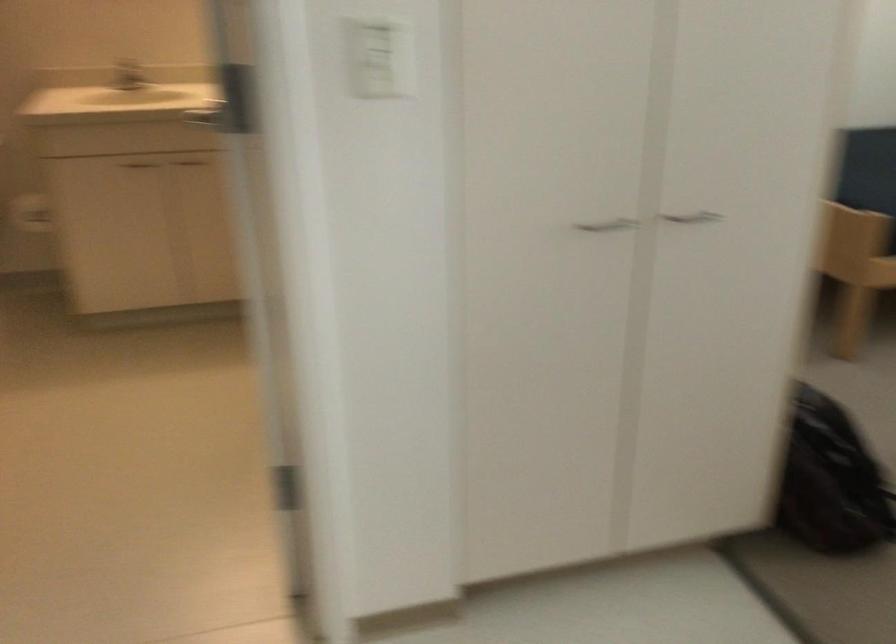
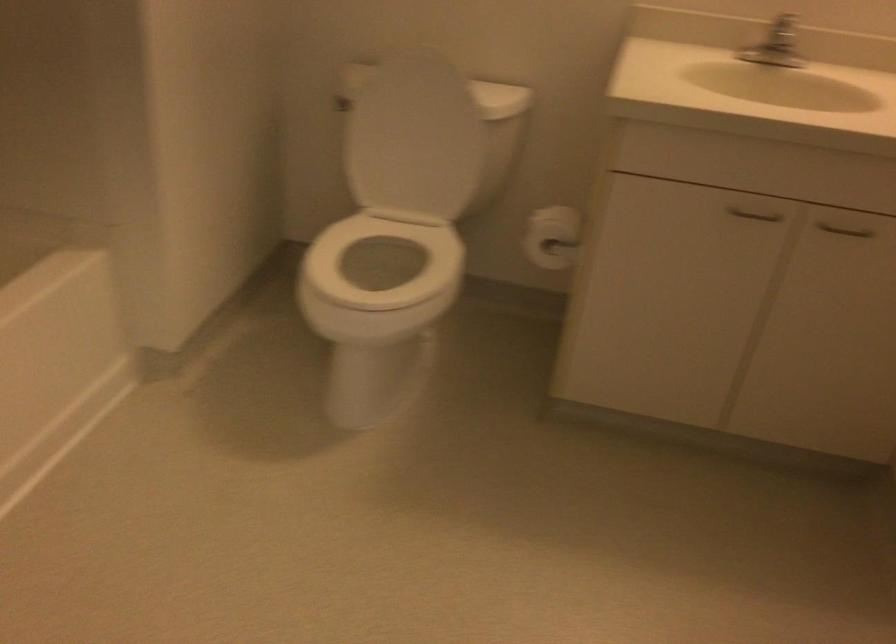
Locate, in the second image, the point that corresponds to point (134, 163) in the first image.

(754, 214)